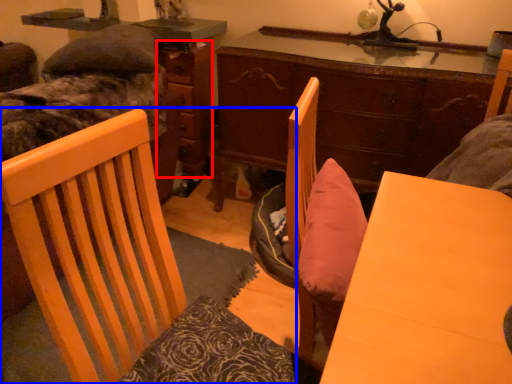
Question: Which object appears closest to the camera in this image, dresser (highlighted by a red box) or chair (highlighted by a blue box)?

Choices:
 (A) dresser
 (B) chair

Answer: (B)